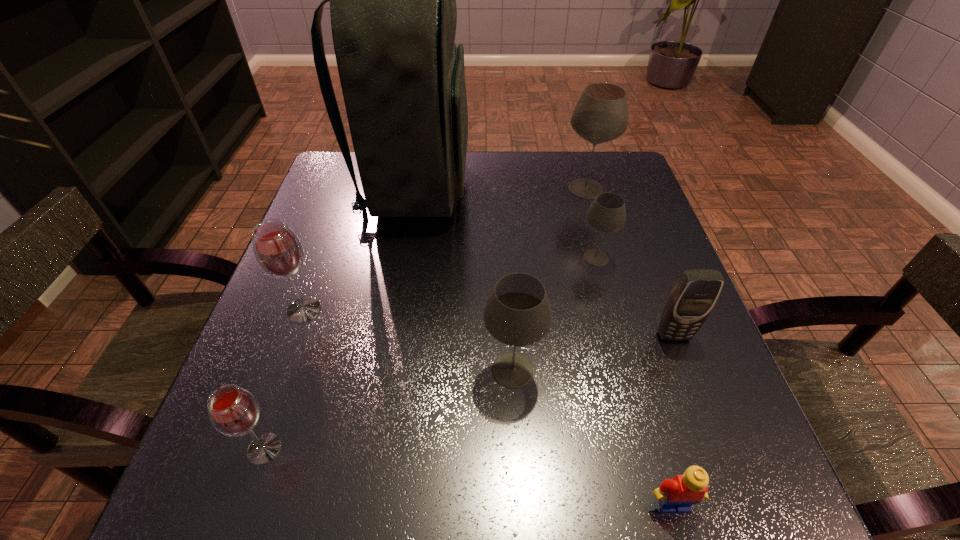
Identify which object is the third nearest to the Lego. Please provide its 2D coordinates. Your answer should be formatted as a tuple, i.e. [(x, y)], where the tuple contains the x and y coordinates of a point satisfying the conditions above.

[(607, 213)]

Locate which wineglass ranks fourth in proximity to the seventh shortest object. Please provide its 2D coordinates. Your answer should be formatted as a tuple, i.e. [(x, y)], where the tuple contains the x and y coordinates of a point satisfying the conditions above.

[(233, 411)]

Find the location of `wineglass identified as the closest to the smaller red wineglass`. wineglass identified as the closest to the smaller red wineglass is located at coordinates (278, 251).

Identify the location of gray wineglass that stands as the second closest to the shortest object. (607, 213).

This screenshot has width=960, height=540. I want to click on the second closest gray wineglass to the sixth nearest object, so click(x=517, y=313).

Locate an element on the screen. The width and height of the screenshot is (960, 540). free space in the image that satisfies the following two spatial constraints: 1. on the front-facing side of the backpack; 2. on the front side of the second nearest object is located at coordinates [x=369, y=449].

Locate an element on the screen. vacant point that satisfies the following two spatial constraints: 1. on the front side of the nearer red wineglass; 2. on the left side of the fifth nearest object is located at coordinates (254, 449).

Where is `vacant position in the image that satisfies the following two spatial constraints: 1. on the front-facing side of the leftmost gray wineglass; 2. on the right side of the tallest object`? This screenshot has width=960, height=540. vacant position in the image that satisfies the following two spatial constraints: 1. on the front-facing side of the leftmost gray wineglass; 2. on the right side of the tallest object is located at coordinates (383, 370).